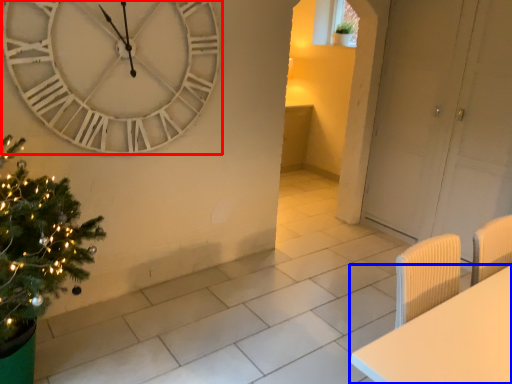
Question: Among these objects, which one is nearest to the camera, wall clock (highlighted by a red box) or furniture (highlighted by a blue box)?

Choices:
 (A) wall clock
 (B) furniture

Answer: (B)